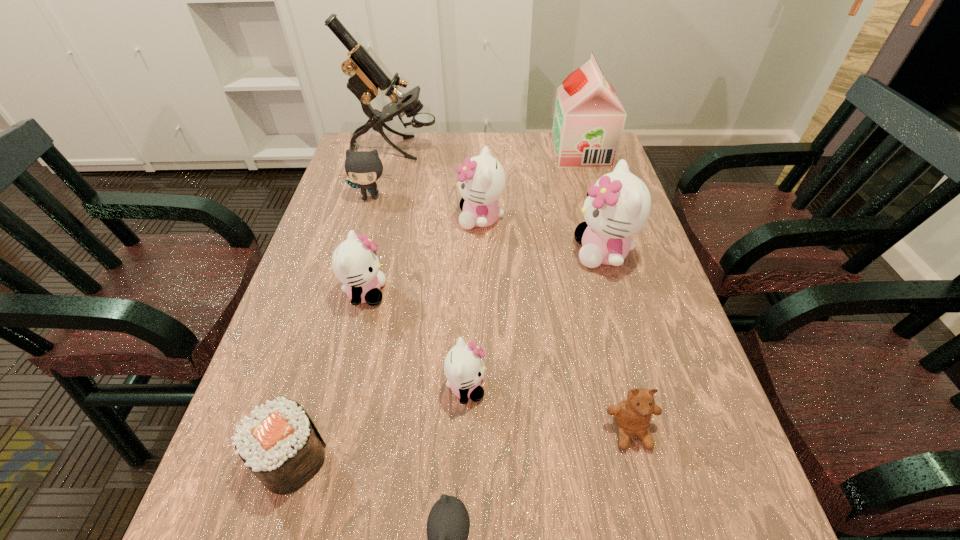
Where is `microscope`? The height and width of the screenshot is (540, 960). microscope is located at coordinates (366, 78).

At what (x,y) coordinates should I click in order to perform the action: click on the ninth shortest object. Please return your answer as a coordinate pair (x, y). This screenshot has height=540, width=960. Looking at the image, I should click on (589, 118).

In order to click on the rightmost white kitten in this screenshot , I will do `click(618, 206)`.

At what (x,y) coordinates should I click in order to perform the action: click on the biggest white kitten. Please return your answer as a coordinate pair (x, y). Image resolution: width=960 pixels, height=540 pixels. Looking at the image, I should click on (618, 206).

In order to click on the seventh shortest object in this screenshot , I will do `click(482, 180)`.

I want to click on the second tallest kitten, so pyautogui.click(x=482, y=180).

Where is `the second smallest white kitten`? The height and width of the screenshot is (540, 960). the second smallest white kitten is located at coordinates (355, 263).

Where is `the farther gray kitten`? the farther gray kitten is located at coordinates (364, 168).

Locate an element on the screen. the bigger gray kitten is located at coordinates (364, 168).

Image resolution: width=960 pixels, height=540 pixels. I want to click on the second nearest kitten, so click(464, 369).